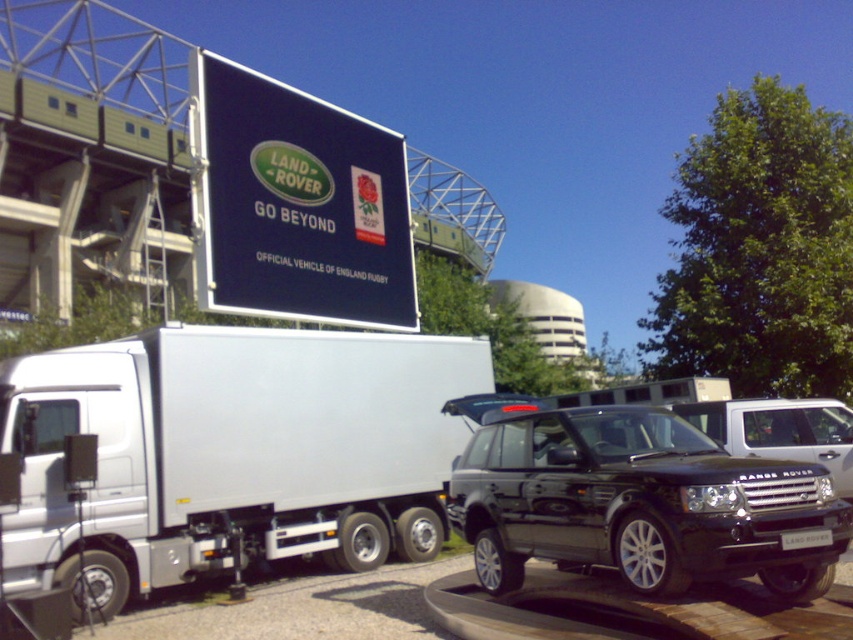
In the scene shown: You are a photographer standing in front of the white metallic trailer truck at left and the black metallic suv at center. You want to capture a photo that includes both vehicles in the frame. Which vehicle should you position closer to the camera to ensure both are fully visible?

The white metallic trailer truck at left is located below the black metallic suv at center. To include both in the frame, position the white metallic trailer truck at left closer to the camera so that the black metallic suv at center can be seen above it without being cut off.

You are a photographer positioned at the base of the stadium. You want to capture both the white metallic trailer truck at left and the black metallic car at center in your shot. Which object should you adjust your camera angle upwards to include in the frame?

You should adjust your camera angle upwards to include the black metallic car at center because the white metallic trailer truck at left is located below it.